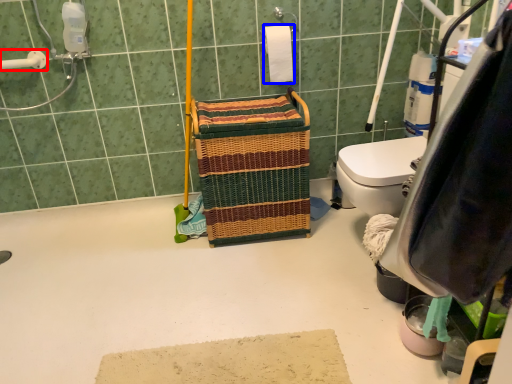
Question: Among these objects, which one is farthest to the camera, shower (highlighted by a red box) or toilet paper (highlighted by a blue box)?

Choices:
 (A) shower
 (B) toilet paper

Answer: (B)